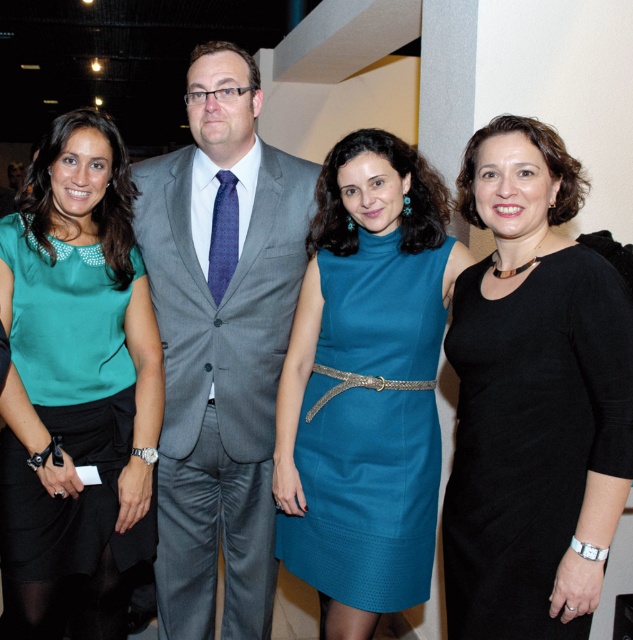
Which is more to the left, gray wool suit at center or teal fabric dress at center?

Positioned to the left is gray wool suit at center.

Is gray wool suit at center further to camera compared to teal fabric dress at center?

That is True.

Between point (265, 352) and point (423, 550), which one is positioned in front?

Point (423, 550) is more forward.

This screenshot has height=640, width=633. In order to click on gray wool suit at center in this screenshot , I will do `click(220, 342)`.

Describe the element at coordinates (75, 388) in the screenshot. I see `teal fabric blouse at left` at that location.

The height and width of the screenshot is (640, 633). Find the location of `teal fabric blouse at left`. teal fabric blouse at left is located at coordinates (75, 388).

Find the location of a particular element. The image size is (633, 640). gray wool suit at center is located at coordinates (220, 342).

Does gray wool suit at center appear on the left side of teal fabric blouse at left?

In fact, gray wool suit at center is to the right of teal fabric blouse at left.

Is point (301, 200) positioned in front of point (122, 515)?

No.

At what (x,y) coordinates should I click in order to perform the action: click on gray wool suit at center. Please return your answer as a coordinate pair (x, y). The image size is (633, 640). Looking at the image, I should click on (220, 342).